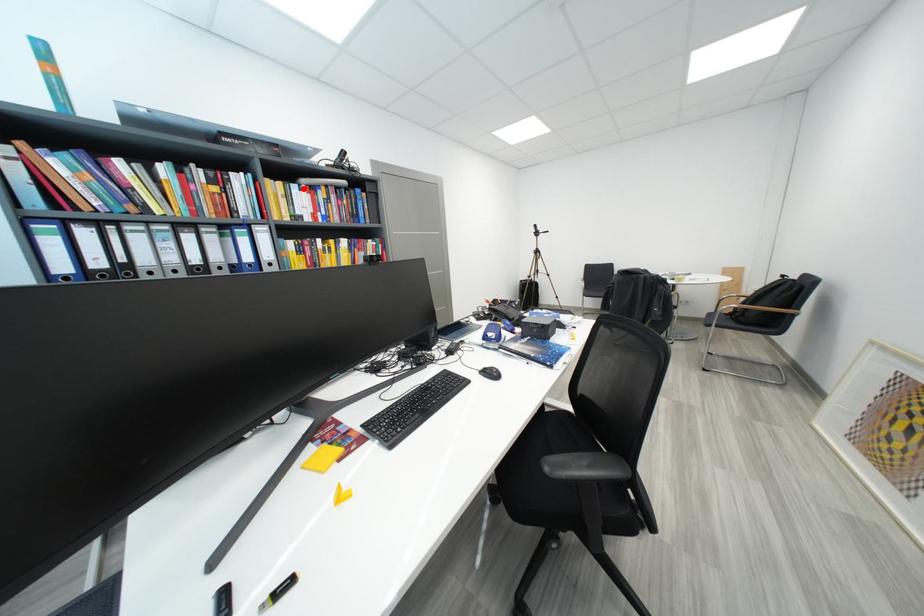
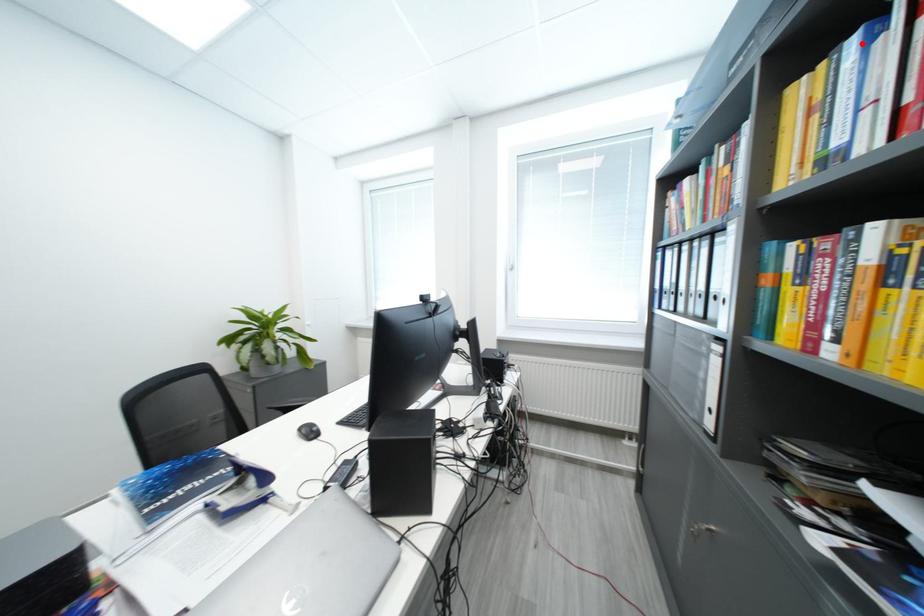
From the picture: I am providing you with two images of the same scene from different viewpoints. A red point is marked on the first image and another point is marked on the second image. Is the marked point in image1 the same physical position as the marked point in image2?

Yes